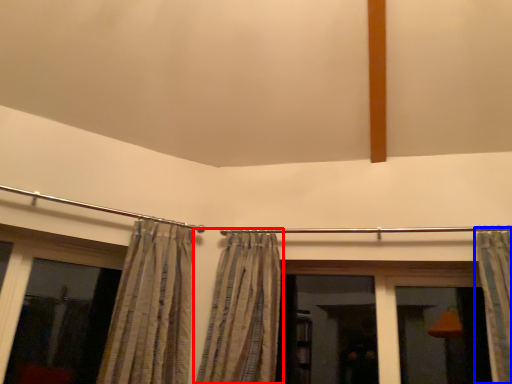
Question: Which object appears closest to the camera in this image, curtain (highlighted by a red box) or curtain (highlighted by a blue box)?

Choices:
 (A) curtain
 (B) curtain

Answer: (B)